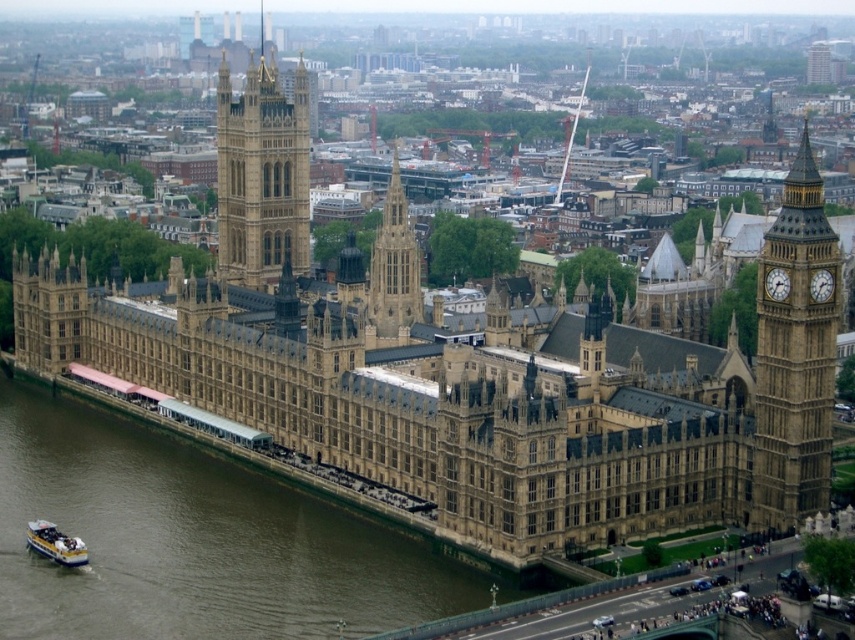
Question: Is brown water at lower left above stone clock tower at right?

Choices:
 (A) no
 (B) yes

Answer: (A)

Question: Can you confirm if gold metallic clock at right is bigger than white metallic clock at right?

Choices:
 (A) no
 (B) yes

Answer: (A)

Question: Which point is closer to the camera?

Choices:
 (A) stone clock tower at right
 (B) gold metallic clock at right
 (C) brown stone spire at center
 (D) blue plastic boat at lower left

Answer: (A)

Question: Does golden stone tower at center appear under blue plastic boat at lower left?

Choices:
 (A) yes
 (B) no

Answer: (B)

Question: Which of the following is the closest to the observer?

Choices:
 (A) gold metallic clock at right
 (B) stone clock tower at right
 (C) brown water at lower left

Answer: (C)

Question: Which point is closer to the camera taking this photo?

Choices:
 (A) (39, 516)
 (B) (394, 176)
 (C) (770, 288)

Answer: (C)